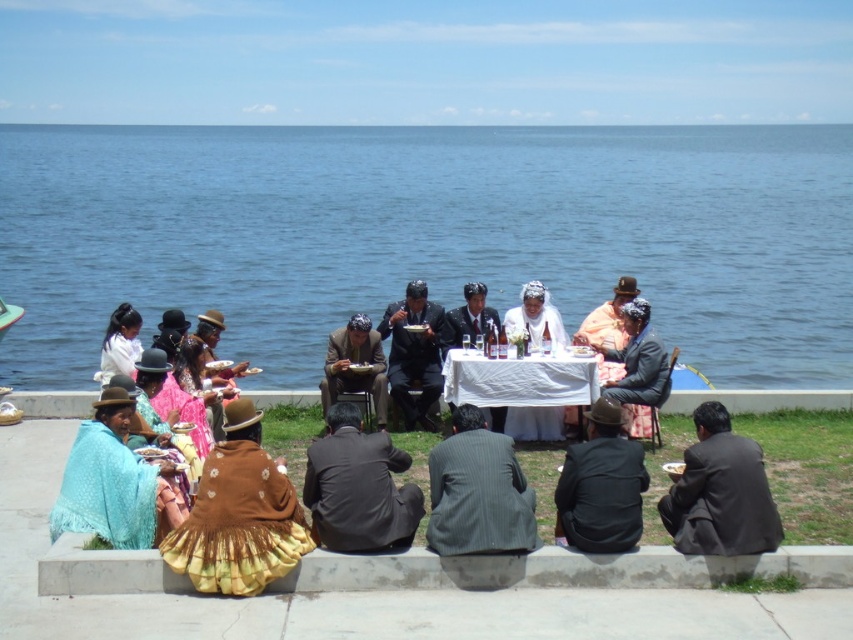
Consider the image. Between knitted teal shawl at lower left and matte brown suit at center, which one appears on the right side from the viewer's perspective?

matte brown suit at center

Who is positioned more to the left, knitted teal shawl at lower left or matte brown suit at center?

Positioned to the left is knitted teal shawl at lower left.

The image size is (853, 640). In order to click on knitted teal shawl at lower left in this screenshot , I will do `click(115, 483)`.

Locate an element on the screen. The width and height of the screenshot is (853, 640). dark gray suit at center is located at coordinates (358, 486).

Does dark gray suit at center appear on the left side of matte brown suit at center?

In fact, dark gray suit at center is to the right of matte brown suit at center.

Is point (346, 496) positioned in front of point (357, 340)?

Yes, point (346, 496) is closer to viewer.

At what (x,y) coordinates should I click in order to perform the action: click on dark gray suit at center. Please return your answer as a coordinate pair (x, y). Looking at the image, I should click on (x=358, y=486).

Who is higher up, white cloth table at center or matte orange shirt at center?

Positioned higher is matte orange shirt at center.

Can you confirm if white cloth table at center is positioned below matte orange shirt at center?

Indeed, white cloth table at center is positioned under matte orange shirt at center.

Which is behind, point (582, 372) or point (581, 337)?

The point (581, 337) is behind.

You are a GUI agent. You are given a task and a screenshot of the screen. Output one action in this format:
    pyautogui.click(x=<x>, y=<y>)
    Task: Click on the white cloth table at center
    
    Given the screenshot: What is the action you would take?
    pyautogui.click(x=521, y=388)